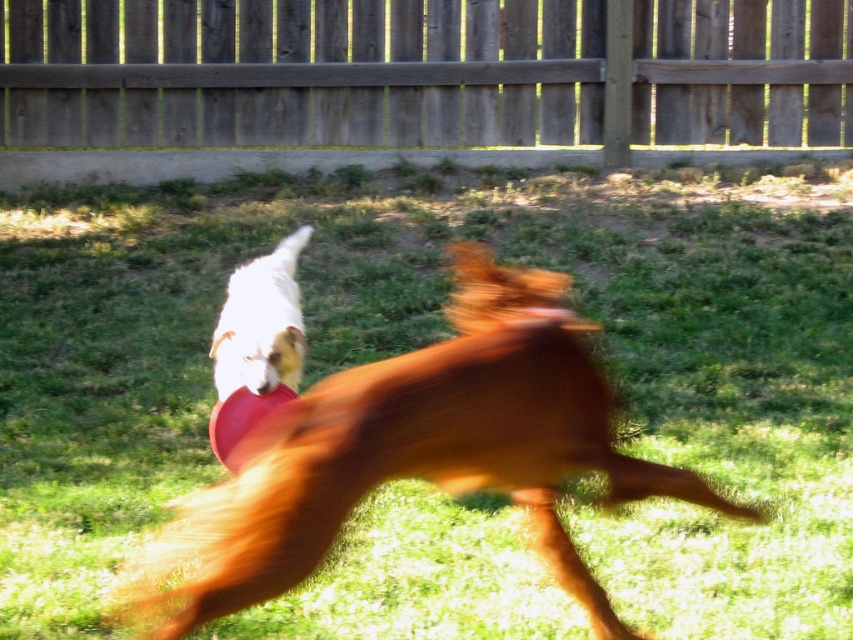
You are standing in the grassy area where the two dogs are playing. There are two points marked in the scene. The first point is at coordinates point (639, 26), and the second point is at point (219, 570). If you want to throw a ball to the point that is closer to you, which point should you aim for?

You should aim for point (219, 570) because it is closer to you than point (639, 26).